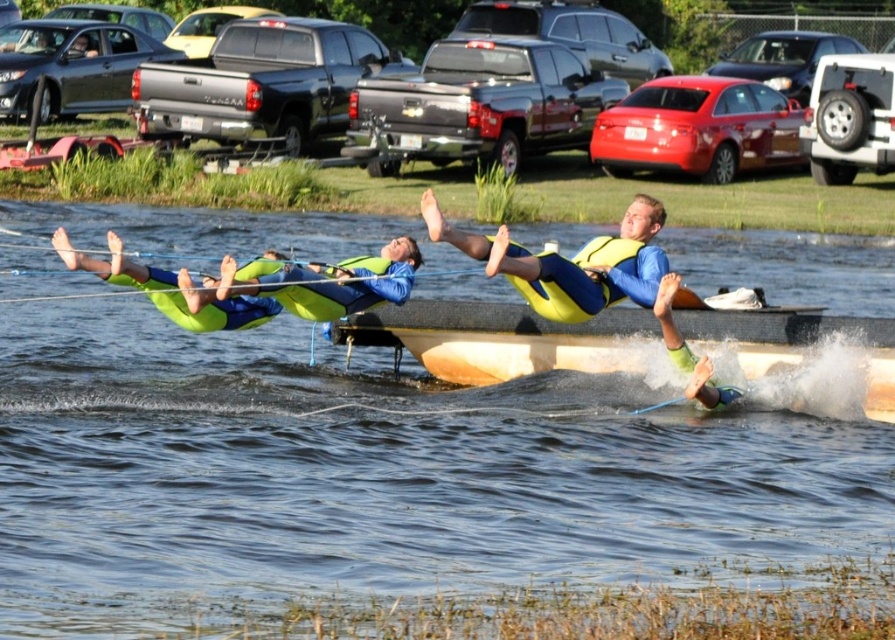
You are a safety inspector checking the safety distance between the wooden boat at center and the yellow life vest at center. The safety regulation requires at least 2 meters between them. Is the current distance compliant?

The wooden boat at center is 2.27 meters from the yellow life vest at center, which exceeds the required 2 meters, so it is compliant.

You are standing at the point marked by the coordinates point (x=500, y=339). What object are you standing on?

You are standing on the wooden boat at center, as the coordinates point (x=500, y=339) marks this location.

You are a photographer trying to capture a photo of the clear water at center and the yellow life vest at center. Based on their positions, which object appears closer to the camera?

The clear water at center is much taller than the yellow life vest at center, which indicates it is closer to the camera.